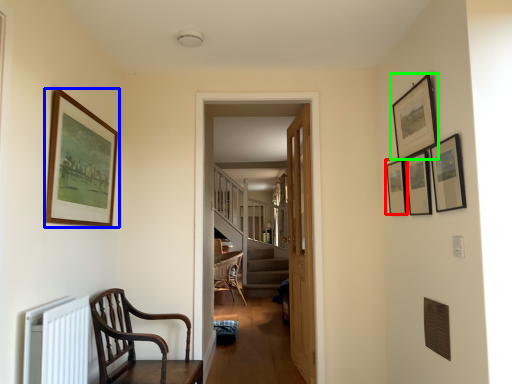
Question: Estimate the real-world distances between objects in this image. Which object is closer to picture frame (highlighted by a red box), picture frame (highlighted by a blue box) or picture frame (highlighted by a green box)?

Choices:
 (A) picture frame
 (B) picture frame

Answer: (B)